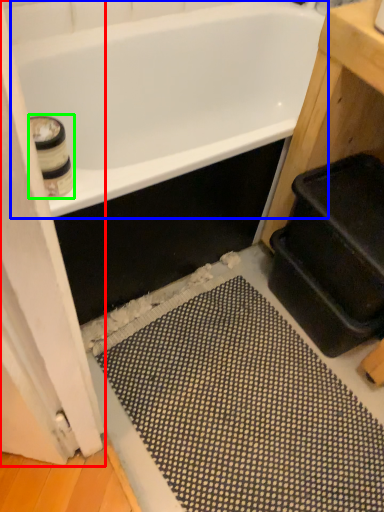
Question: Considering the real-world distances, which object is closest to screen door (highlighted by a red box)? bathtub (highlighted by a blue box) or toilet paper (highlighted by a green box).

Choices:
 (A) bathtub
 (B) toilet paper

Answer: (B)